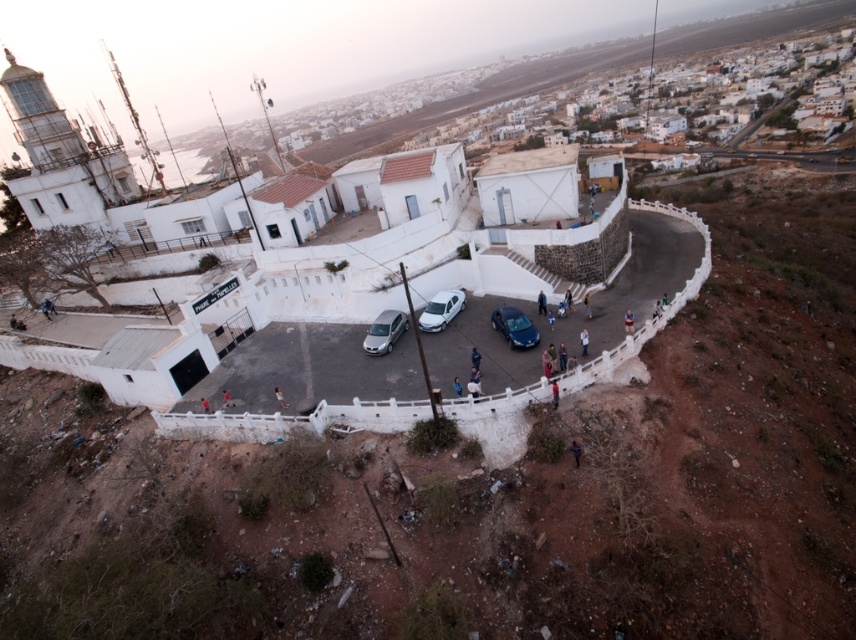
Is light blue fabric shirt at center to the left of light brown leather jacket at center from the viewer's perspective?

Incorrect, light blue fabric shirt at center is not on the left side of light brown leather jacket at center.

Identify the location of light blue fabric shirt at center. (628, 323).

Locate an element on the screen. Image resolution: width=856 pixels, height=640 pixels. light blue fabric shirt at center is located at coordinates tap(628, 323).

Does dark blue jeans at lower left have a lesser width compared to blue fabric person at center?

In fact, dark blue jeans at lower left might be wider than blue fabric person at center.

Is dark blue jeans at lower left wider than blue fabric person at center?

Yes, dark blue jeans at lower left is wider than blue fabric person at center.

In order to click on dark blue jeans at lower left in this screenshot , I will do `click(46, 308)`.

How much distance is there between white matte van at center and dark blue jeans at center?

8.62 meters

Which is behind, point (431, 324) or point (541, 300)?

Point (541, 300)

Does point (432, 301) lie in front of point (538, 298)?

No, (432, 301) is further to viewer.

The image size is (856, 640). Find the location of `white matte van at center`. white matte van at center is located at coordinates (441, 308).